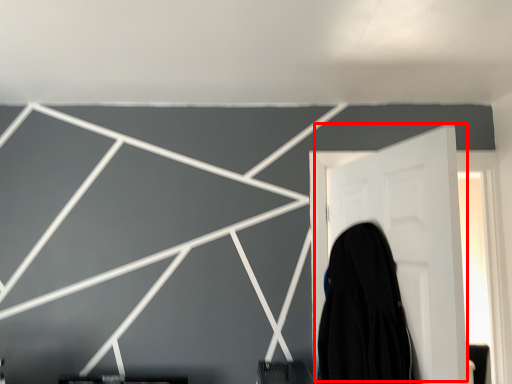
Question: From the image's perspective, where is door (annotated by the red box) located in relation to garment in the image?

Choices:
 (A) below
 (B) above

Answer: (B)